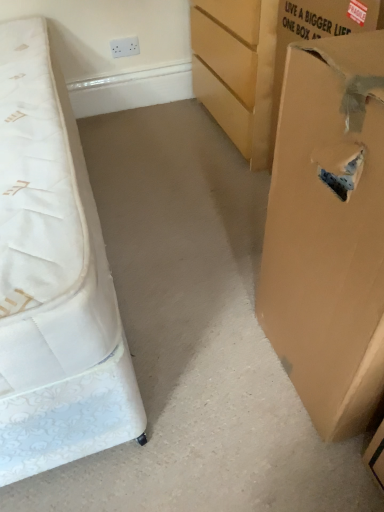
Question: From the image's perspective, is white quilted mattress at left under brown cardboard box at right, marked as the first cardboard box in a bottom-to-top arrangement?

Choices:
 (A) yes
 (B) no

Answer: (B)

Question: Is white quilted mattress at left looking in the opposite direction of brown cardboard box at right, the 1th cardboard box from the front?

Choices:
 (A) yes
 (B) no

Answer: (B)

Question: Is white quilted mattress at left positioned behind brown cardboard box at right, acting as the 2th cardboard box starting from the top?

Choices:
 (A) no
 (B) yes

Answer: (B)

Question: Is white quilted mattress at left smaller than brown cardboard box at right, the 2th cardboard box in the back-to-front sequence?

Choices:
 (A) no
 (B) yes

Answer: (A)

Question: Is the position of white quilted mattress at left less distant than that of brown cardboard box at right, the 2th cardboard box in the back-to-front sequence?

Choices:
 (A) yes
 (B) no

Answer: (B)

Question: Can you confirm if white quilted mattress at left is bigger than brown cardboard box at right, acting as the 2th cardboard box starting from the top?

Choices:
 (A) yes
 (B) no

Answer: (A)

Question: Can you confirm if brown cardboard box at right, the 1th cardboard box from the front, is positioned to the right of brown cardboard box at right, arranged as the second cardboard box when viewed from the front?

Choices:
 (A) yes
 (B) no

Answer: (A)

Question: Considering the relative sizes of brown cardboard box at right, marked as the first cardboard box in a bottom-to-top arrangement, and brown cardboard box at right, which ranks as the second cardboard box in bottom-to-top order, in the image provided, is brown cardboard box at right, marked as the first cardboard box in a bottom-to-top arrangement, shorter than brown cardboard box at right, which ranks as the second cardboard box in bottom-to-top order,?

Choices:
 (A) no
 (B) yes

Answer: (A)

Question: From the image's perspective, is brown cardboard box at right, the 1th cardboard box from the front, above brown cardboard box at right, positioned as the 1th cardboard box in top-to-bottom order?

Choices:
 (A) no
 (B) yes

Answer: (A)

Question: Is brown cardboard box at right, marked as the first cardboard box in a bottom-to-top arrangement, positioned beyond the bounds of brown cardboard box at right, which ranks as the second cardboard box in bottom-to-top order?

Choices:
 (A) yes
 (B) no

Answer: (A)

Question: Would you say brown cardboard box at right, which ranks as the second cardboard box in bottom-to-top order, is part of brown cardboard box at right, the 2th cardboard box in the back-to-front sequence,'s contents?

Choices:
 (A) yes
 (B) no

Answer: (B)

Question: From a real-world perspective, is brown cardboard box at right, the 2th cardboard box in the back-to-front sequence, located beneath brown cardboard box at right, positioned as the 1th cardboard box in top-to-bottom order?

Choices:
 (A) no
 (B) yes

Answer: (A)

Question: Does white quilted mattress at left contain brown cardboard box at right, positioned as the 1th cardboard box in top-to-bottom order?

Choices:
 (A) yes
 (B) no

Answer: (B)